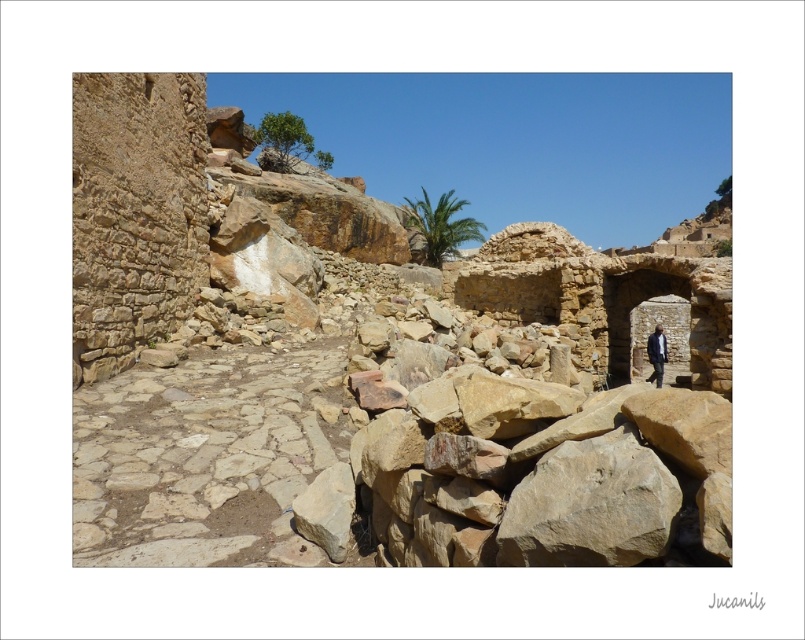
Is green leafy palm at center smaller than dark blue suit at right?

Incorrect, green leafy palm at center is not smaller in size than dark blue suit at right.

Which of these two, green leafy palm at center or dark blue suit at right, stands taller?

green leafy palm at center is taller.

Identify the location of green leafy palm at center. (440, 225).

Image resolution: width=805 pixels, height=640 pixels. What are the coordinates of `green leafy palm at center` in the screenshot? It's located at [440, 225].

Consider the image. Can you confirm if brown stone ruins at center is positioned to the left of green leafy palm at center?

Indeed, brown stone ruins at center is positioned on the left side of green leafy palm at center.

Is brown stone ruins at center positioned before green leafy palm at center?

Yes, it is.

The width and height of the screenshot is (805, 640). Describe the element at coordinates (349, 365) in the screenshot. I see `brown stone ruins at center` at that location.

You are a GUI agent. You are given a task and a screenshot of the screen. Output one action in this format:
    pyautogui.click(x=<x>, y=<y>)
    Task: Click on the brown stone ruins at center
    
    Given the screenshot: What is the action you would take?
    pyautogui.click(x=349, y=365)

Does brown stone ruins at center have a greater width compared to dark blue suit at right?

Yes.

Who is higher up, brown stone ruins at center or dark blue suit at right?

brown stone ruins at center

The height and width of the screenshot is (640, 805). What do you see at coordinates (349, 365) in the screenshot?
I see `brown stone ruins at center` at bounding box center [349, 365].

At what (x,y) coordinates should I click in order to perform the action: click on brown stone ruins at center. Please return your answer as a coordinate pair (x, y). This screenshot has width=805, height=640. Looking at the image, I should click on (349, 365).